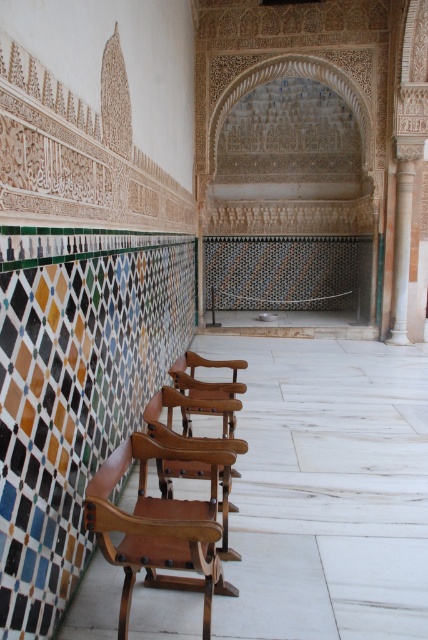
Question: Is brown leather chair at left bigger than green marble column at right?

Choices:
 (A) no
 (B) yes

Answer: (A)

Question: Which of the following is the closest to the observer?

Choices:
 (A) green marble column at right
 (B) brown leather chair at left

Answer: (B)

Question: Observing the image, what is the correct spatial positioning of brown leather chair at left in reference to green marble column at right?

Choices:
 (A) right
 (B) left

Answer: (B)

Question: Does brown leather chair at left have a larger size compared to green marble column at right?

Choices:
 (A) yes
 (B) no

Answer: (B)